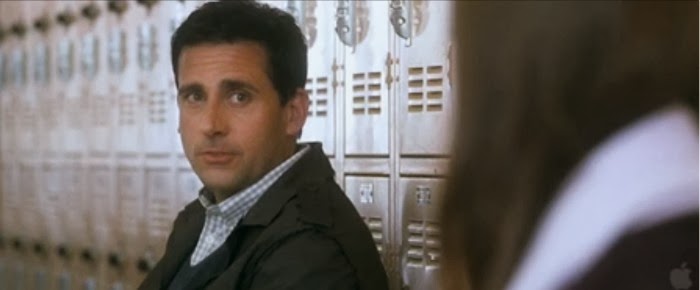
The width and height of the screenshot is (700, 290). I want to click on locker, so click(372, 120).